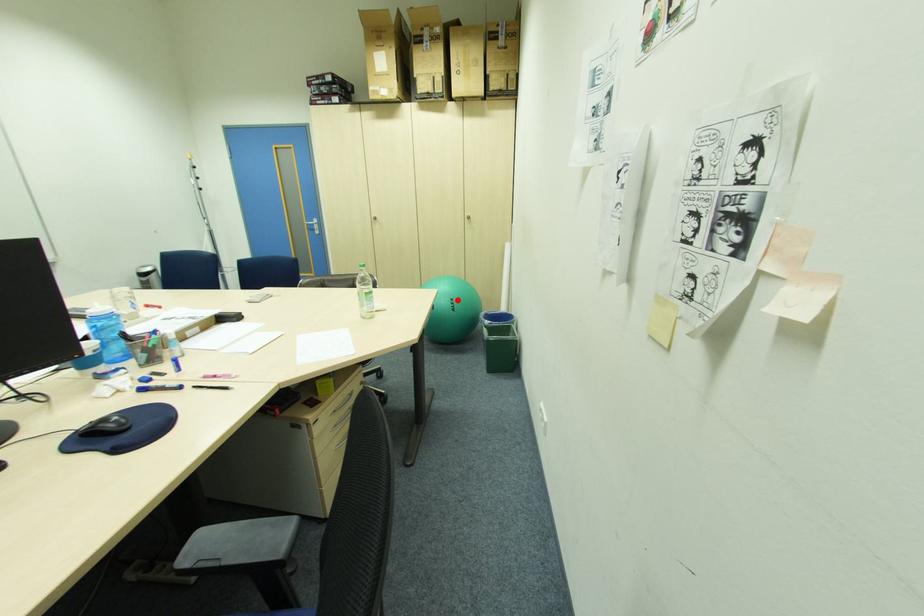
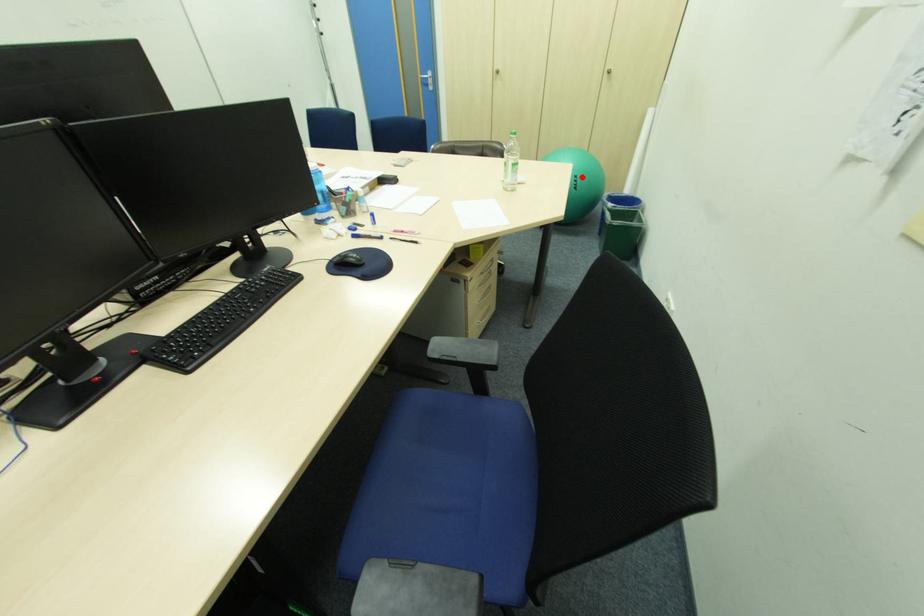
I am providing you with two images of the same scene from different viewpoints. A red point is marked on the first image and another point is marked on the second image. Is the red point in image1 aligned with the point shown in image2?

Yes